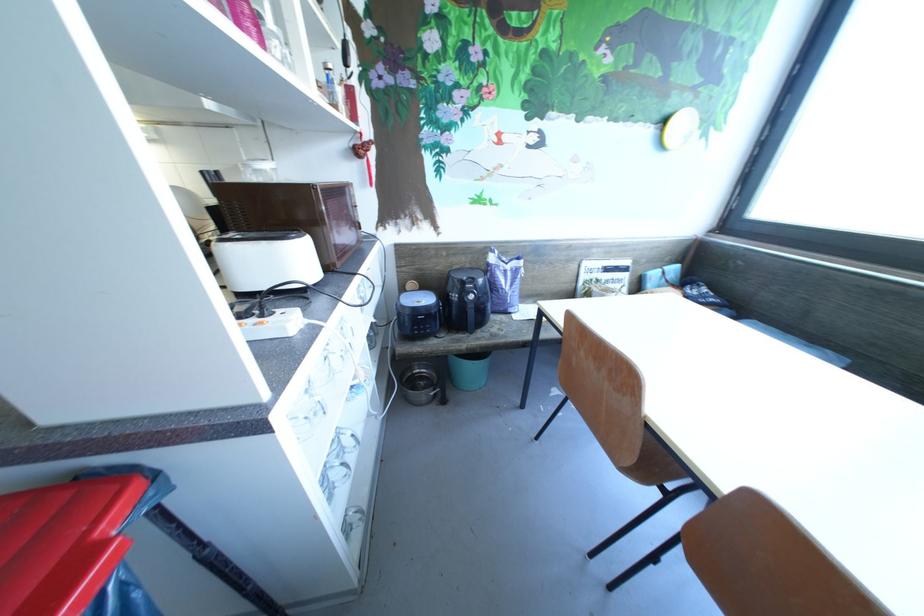
Find where to grasp the air fryer handle. Please return your answer as a coordinate pair (x, y).

(470, 318)